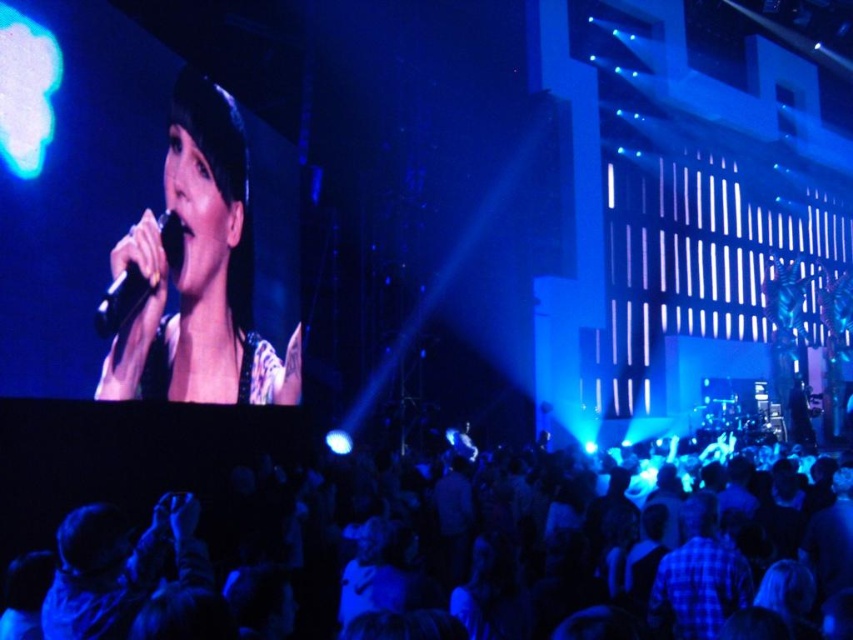
You are a photographer at the concert and want to capture both the matte black microphone at upper left and the black glossy microphone at upper left in a single shot. However, your camera has a limited focus range. Which microphone should you focus on first to ensure it appears sharp in the photo?

The matte black microphone at upper left has a greater height compared to the black glossy microphone at upper left. Since the camera focuses on closer objects first, you should focus on the taller matte black microphone at upper left to ensure it is sharp.

You are a photographer at the concert and want to capture a photo that includes both the black fabric crowd at lower center and the black glossy microphone at upper left. Based on their positions, which object should you focus on first to ensure both are in frame?

The black fabric crowd at lower center is located below the black glossy microphone at upper left. To include both in the frame, focus on the microphone first as it is higher up, then adjust the camera angle downward to include the crowd below.